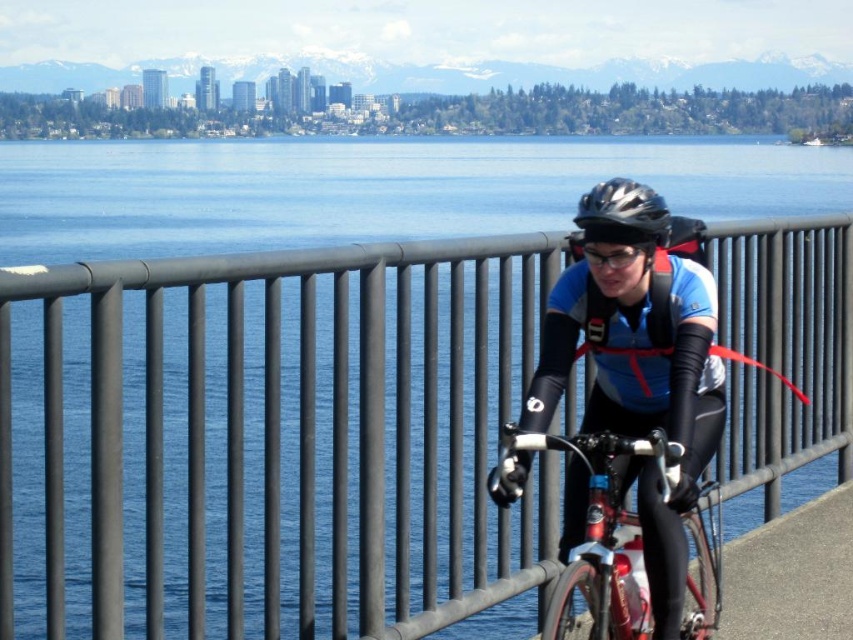
Question: Based on their relative distances, which object is farther from the shiny metallic bicycle at center?

Choices:
 (A) black metal fence at center
 (B) transparent plastic goggles at center

Answer: (A)

Question: Does black metal fence at center appear over transparent plastic goggles at center?

Choices:
 (A) yes
 (B) no

Answer: (B)

Question: Can you confirm if shiny metallic bicycle at center is thinner than transparent plastic goggles at center?

Choices:
 (A) yes
 (B) no

Answer: (B)

Question: Can you confirm if shiny metallic bicycle at center is wider than transparent plastic goggles at center?

Choices:
 (A) yes
 (B) no

Answer: (A)

Question: Among these objects, which one is farthest from the camera?

Choices:
 (A) transparent plastic goggles at center
 (B) black metal fence at center
 (C) shiny metallic bicycle at center
 (D) matte blue jersey at center

Answer: (A)

Question: Which of these objects is positioned closest to the transparent plastic goggles at center?

Choices:
 (A) matte blue jersey at center
 (B) black metal fence at center

Answer: (A)